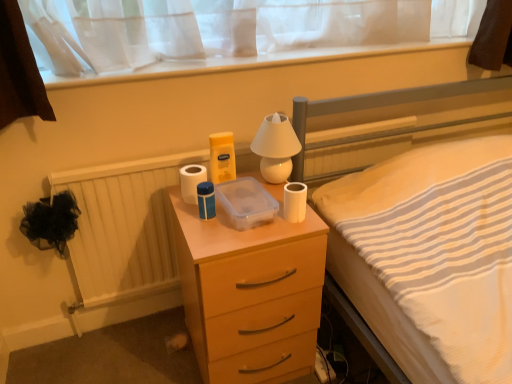
Question: Is white glossy lamp at upper center not within matte wood chest of drawers at center?

Choices:
 (A) no
 (B) yes

Answer: (B)

Question: Can you confirm if white glossy lamp at upper center is bigger than matte wood chest of drawers at center?

Choices:
 (A) no
 (B) yes

Answer: (A)

Question: Is white glossy lamp at upper center with matte wood chest of drawers at center?

Choices:
 (A) yes
 (B) no

Answer: (B)

Question: Is white glossy lamp at upper center aimed at matte wood chest of drawers at center?

Choices:
 (A) yes
 (B) no

Answer: (B)

Question: Is white glossy lamp at upper center thinner than matte wood chest of drawers at center?

Choices:
 (A) no
 (B) yes

Answer: (B)

Question: Considering the relative positions of white glossy lamp at upper center and matte wood chest of drawers at center in the image provided, is white glossy lamp at upper center behind matte wood chest of drawers at center?

Choices:
 (A) yes
 (B) no

Answer: (A)

Question: Does matte wood chest of drawers at center have a larger size compared to white matte toilet paper at right, which is counted as the first toilet paper, starting from the right?

Choices:
 (A) no
 (B) yes

Answer: (B)

Question: Is matte wood chest of drawers at center to the left of white matte toilet paper at right, arranged as the first toilet paper when viewed from the front, from the viewer's perspective?

Choices:
 (A) no
 (B) yes

Answer: (B)

Question: From a real-world perspective, is matte wood chest of drawers at center on white matte toilet paper at right, arranged as the first toilet paper when viewed from the front?

Choices:
 (A) no
 (B) yes

Answer: (A)

Question: From the image's perspective, is matte wood chest of drawers at center on top of white matte toilet paper at right, which is the second toilet paper in back-to-front order?

Choices:
 (A) no
 (B) yes

Answer: (A)

Question: Is matte wood chest of drawers at center wider than white matte toilet paper at right, which is the second toilet paper in back-to-front order?

Choices:
 (A) no
 (B) yes

Answer: (B)

Question: Are matte wood chest of drawers at center and white matte toilet paper at right, arranged as the first toilet paper when viewed from the front, far apart?

Choices:
 (A) no
 (B) yes

Answer: (A)

Question: Is white matte toilet paper at right, which is counted as the first toilet paper, starting from the right, positioned with its back to white matte toilet paper at center, the 2th toilet paper positioned from the front?

Choices:
 (A) yes
 (B) no

Answer: (B)